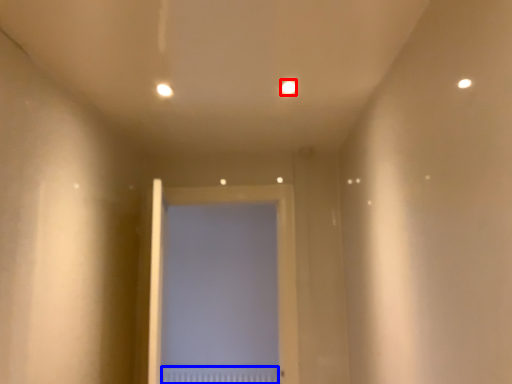
Question: Which object appears farthest to the camera in this image, light (highlighted by a red box) or radiator (highlighted by a blue box)?

Choices:
 (A) light
 (B) radiator

Answer: (B)